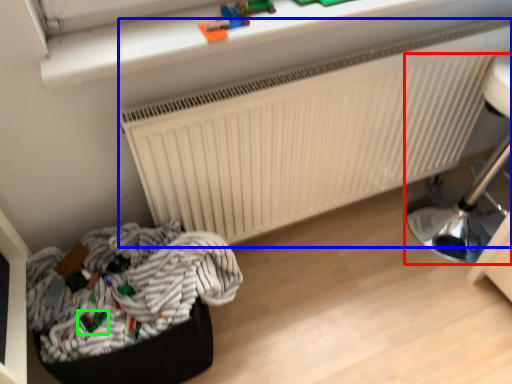
Question: Based on their relative distances, which object is nearer to furniture (highlighted by a red box)? Choose from radiator (highlighted by a blue box) and toy (highlighted by a green box).

Choices:
 (A) radiator
 (B) toy

Answer: (A)